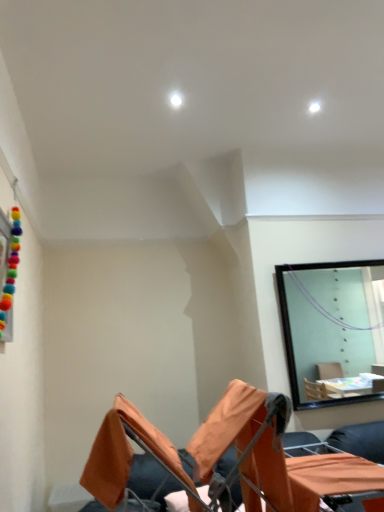
Question: Is orange fabric table at lower right further to the viewer compared to orange fabric chair at lower center?

Choices:
 (A) no
 (B) yes

Answer: (B)

Question: Can you confirm if orange fabric table at lower right is thinner than orange fabric chair at lower center?

Choices:
 (A) yes
 (B) no

Answer: (A)

Question: Does orange fabric table at lower right have a greater height compared to orange fabric chair at lower center?

Choices:
 (A) no
 (B) yes

Answer: (A)

Question: Is the depth of orange fabric table at lower right less than that of orange fabric chair at lower center?

Choices:
 (A) yes
 (B) no

Answer: (B)

Question: Is the surface of orange fabric table at lower right in direct contact with orange fabric chair at lower center?

Choices:
 (A) yes
 (B) no

Answer: (B)

Question: From a real-world perspective, is orange fabric table at lower right positioned over orange fabric chair at lower center based on gravity?

Choices:
 (A) no
 (B) yes

Answer: (A)

Question: From a real-world perspective, is orange fabric chair at lower center located beneath orange fabric table at lower right?

Choices:
 (A) no
 (B) yes

Answer: (A)

Question: Can you confirm if orange fabric chair at lower center is bigger than orange fabric table at lower right?

Choices:
 (A) yes
 (B) no

Answer: (A)

Question: Could you tell me if orange fabric chair at lower center is facing orange fabric table at lower right?

Choices:
 (A) no
 (B) yes

Answer: (B)

Question: Does orange fabric chair at lower center have a greater height compared to orange fabric table at lower right?

Choices:
 (A) no
 (B) yes

Answer: (B)

Question: Are orange fabric chair at lower center and orange fabric table at lower right beside each other?

Choices:
 (A) yes
 (B) no

Answer: (B)

Question: Does orange fabric chair at lower center have a lesser width compared to orange fabric table at lower right?

Choices:
 (A) no
 (B) yes

Answer: (A)

Question: Is orange fabric chair at lower center bigger or smaller than orange fabric table at lower right?

Choices:
 (A) small
 (B) big

Answer: (B)